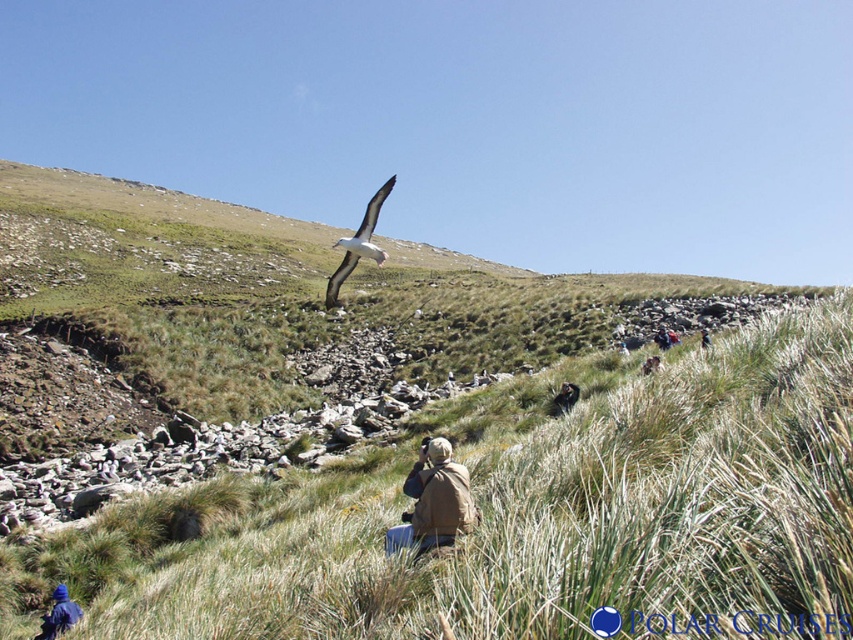
Is blue fabric jacket at lower left to the left of brown leather jacket at lower center from the viewer's perspective?

Yes, blue fabric jacket at lower left is to the left of brown leather jacket at lower center.

Is blue fabric jacket at lower left bigger than brown leather jacket at lower center?

Correct, blue fabric jacket at lower left is larger in size than brown leather jacket at lower center.

Find the location of `blue fabric jacket at lower left`. blue fabric jacket at lower left is located at coordinates (59, 614).

Can you confirm if green grassy at center is smaller than white feathered bird at upper center?

No, green grassy at center is not smaller than white feathered bird at upper center.

Based on the photo, between green grassy at center and white feathered bird at upper center, which one appears on the left side from the viewer's perspective?

Positioned to the left is white feathered bird at upper center.

This screenshot has width=853, height=640. I want to click on green grassy at center, so click(524, 520).

Between brown leather jacket at lower center and brown leather jacket at upper center, which one is positioned higher?

brown leather jacket at upper center

Is point (560, 401) closer to viewer compared to point (654, 337)?

Yes, point (560, 401) is closer to viewer.

Does point (564, 408) come farther from viewer compared to point (665, 339)?

No, it is not.

Find the location of a particular element. This screenshot has width=853, height=640. brown leather jacket at lower center is located at coordinates (564, 397).